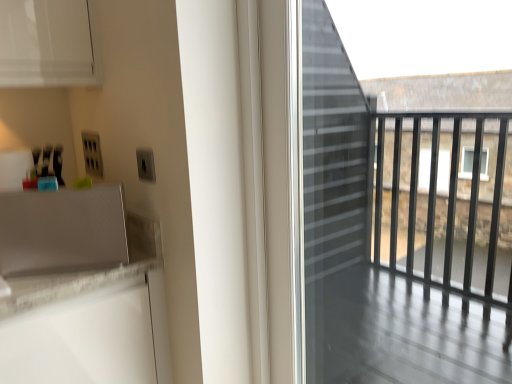
Question: Would you say satin silver speaker at lower left is to the left or to the right of transparent glass screen door at right in the picture?

Choices:
 (A) left
 (B) right

Answer: (A)

Question: From their relative heights in the image, would you say satin silver speaker at lower left is taller or shorter than transparent glass screen door at right?

Choices:
 (A) tall
 (B) short

Answer: (B)

Question: Is satin silver speaker at lower left inside the boundaries of transparent glass screen door at right, or outside?

Choices:
 (A) inside
 (B) outside

Answer: (B)

Question: From the image's perspective, relative to satin silver speaker at lower left, is transparent glass screen door at right above or below?

Choices:
 (A) below
 (B) above

Answer: (A)

Question: In terms of size, does transparent glass screen door at right appear bigger or smaller than satin silver speaker at lower left?

Choices:
 (A) small
 (B) big

Answer: (B)

Question: Is transparent glass screen door at right inside the boundaries of satin silver speaker at lower left, or outside?

Choices:
 (A) inside
 (B) outside

Answer: (B)

Question: Considering their positions, is transparent glass screen door at right located in front of or behind satin silver speaker at lower left?

Choices:
 (A) front
 (B) behind

Answer: (A)